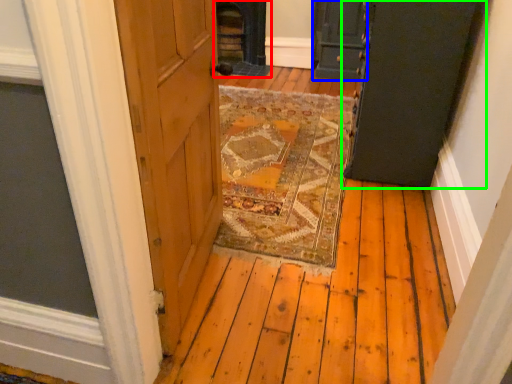
Question: Which object is positioned farthest from fireplace (highlighted by a red box)? Select from door (highlighted by a blue box) and door (highlighted by a green box).

Choices:
 (A) door
 (B) door

Answer: (B)